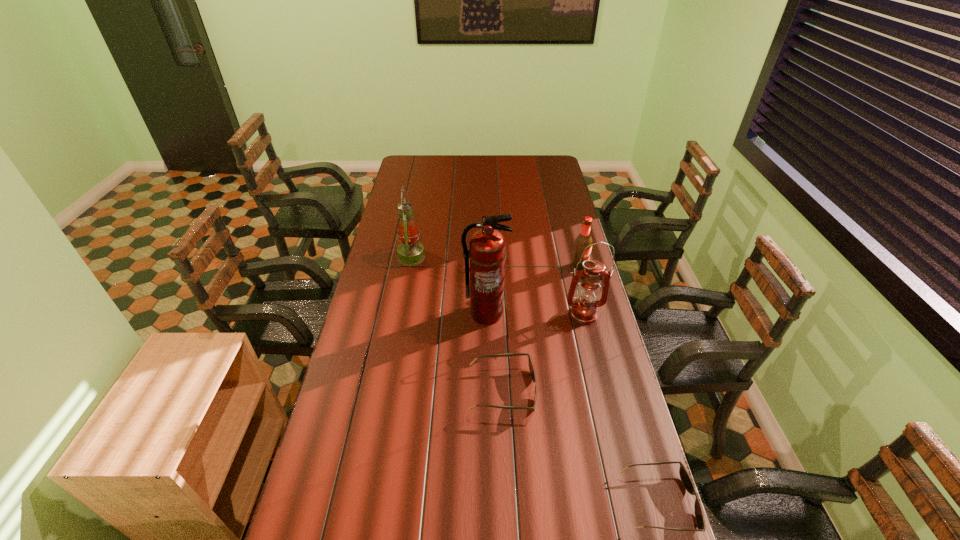
In the image, there is a desktop. Identify the location of vacant space at the far edge. pyautogui.click(x=474, y=171).

Locate an element on the screen. This screenshot has height=540, width=960. vacant space at the left edge of the desktop is located at coordinates (391, 307).

Identify the location of vacant space at the right edge. This screenshot has width=960, height=540. (567, 274).

Where is `empty space that is in between the third shortest object and the nearer sunglasses`? empty space that is in between the third shortest object and the nearer sunglasses is located at coordinates (619, 384).

Identify the location of vacant space in between the fourth tallest object and the shorter sunglasses. (619, 384).

Find the location of `vacant area that lies between the farther sunglasses and the nearer oil lamp`. vacant area that lies between the farther sunglasses and the nearer oil lamp is located at coordinates (542, 353).

Identify the location of vacant area that lies between the tallest object and the left oil lamp. (448, 285).

The image size is (960, 540). I want to click on empty space that is in between the beer bottle and the nearer sunglasses, so click(x=619, y=384).

The image size is (960, 540). What are the coordinates of `the second closest object to the beer bottle` in the screenshot? It's located at (487, 248).

Locate an element on the screen. This screenshot has width=960, height=540. object that is the fourth closest to the shortest object is located at coordinates (584, 239).